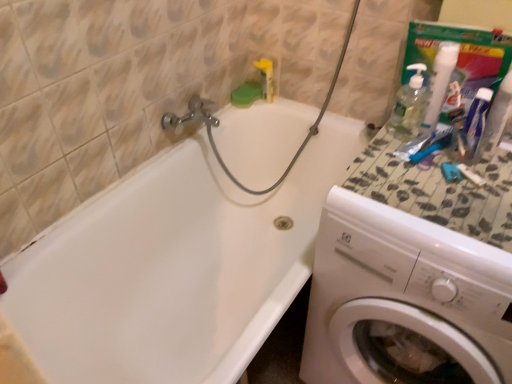
Describe the element at coordinates (404, 300) in the screenshot. This screenshot has width=512, height=384. I see `white plastic washing machine at right` at that location.

At what (x,y) coordinates should I click in order to perform the action: click on white plastic toothpaste at upper right. Please return your answer as a coordinate pair (x, y). Looking at the image, I should click on (x=498, y=113).

What is the approximate height of yellow plastic toothbrush at upper center?

yellow plastic toothbrush at upper center is 7.00 inches tall.

What do you see at coordinates (266, 78) in the screenshot?
I see `yellow plastic toothbrush at upper center` at bounding box center [266, 78].

What do you see at coordinates (438, 190) in the screenshot?
I see `speckled stone countertop at right` at bounding box center [438, 190].

This screenshot has width=512, height=384. I want to click on white pump bottle at upper right, which is counted as the 2th cleaning product, starting from the left, so click(x=439, y=83).

This screenshot has width=512, height=384. Describe the element at coordinates (410, 104) in the screenshot. I see `clear liquid soap at upper right, marked as the first cleaning product in a left-to-right arrangement` at that location.

Locate an element on the screen. This screenshot has height=384, width=512. white plastic washing machine at right is located at coordinates (404, 300).

Considering the sizes of white plastic toothpaste at upper right and white pump bottle at upper right, which is counted as the 2th cleaning product, starting from the left, in the image, is white plastic toothpaste at upper right taller or shorter than white pump bottle at upper right, which is counted as the 2th cleaning product, starting from the left,?

In the image, white plastic toothpaste at upper right appears to be shorter than white pump bottle at upper right, which is counted as the 2th cleaning product, starting from the left.

Considering the sizes of objects white plastic toothpaste at upper right and white pump bottle at upper right, which is counted as the 2th cleaning product, starting from the left, in the image provided, who is smaller, white plastic toothpaste at upper right or white pump bottle at upper right, which is counted as the 2th cleaning product, starting from the left,?

white plastic toothpaste at upper right.

Is white pump bottle at upper right, the 1th cleaning product viewed from the right, surrounded by white plastic toothpaste at upper right?

No, white pump bottle at upper right, the 1th cleaning product viewed from the right, is not inside white plastic toothpaste at upper right.

Are white plastic washing machine at right and white pump bottle at upper right, which is counted as the 2th cleaning product, starting from the left, located far from each other?

white plastic washing machine at right is near white pump bottle at upper right, which is counted as the 2th cleaning product, starting from the left, not far away.

Does white plastic washing machine at right contain white pump bottle at upper right, the 1th cleaning product viewed from the right?

No, white pump bottle at upper right, the 1th cleaning product viewed from the right, is not inside white plastic washing machine at right.

Considering the positions of point (302, 375) and point (457, 57), is point (302, 375) closer or farther from the camera than point (457, 57)?

Point (302, 375).

Is white pump bottle at upper right, which is counted as the 2th cleaning product, starting from the left, at the back of white plastic washing machine at right?

No.

Is white glossy bathtub at upper left next to clear liquid soap at upper right, marked as the first cleaning product in a left-to-right arrangement, and touching it?

No, white glossy bathtub at upper left is not in contact with clear liquid soap at upper right, marked as the first cleaning product in a left-to-right arrangement.

Is point (32, 265) in front of point (406, 97)?

Yes, it is in front of point (406, 97).

Is white glossy bathtub at upper left positioned with its back to clear liquid soap at upper right, positioned as the 2th cleaning product in right-to-left order?

No, white glossy bathtub at upper left's orientation is not away from clear liquid soap at upper right, positioned as the 2th cleaning product in right-to-left order.

Is white plastic toothpaste at upper right touching yellow plastic toothbrush at upper center?

white plastic toothpaste at upper right and yellow plastic toothbrush at upper center are clearly separated.

Does point (511, 108) appear closer or farther from the camera than point (267, 59)?

Point (511, 108) is closer to the camera than point (267, 59).

Does white plastic toothpaste at upper right have a lesser height compared to yellow plastic toothbrush at upper center?

Incorrect, the height of white plastic toothpaste at upper right does not fall short of that of yellow plastic toothbrush at upper center.

The width and height of the screenshot is (512, 384). What are the coordinates of `bottle above the yellow plastic toothbrush at upper center (from a real-world perspective)` in the screenshot? It's located at (498, 113).

Considering the relative positions of yellow plastic toothbrush at upper center and white plastic toothpaste at upper right in the image provided, is yellow plastic toothbrush at upper center behind white plastic toothpaste at upper right?

Yes, yellow plastic toothbrush at upper center is behind white plastic toothpaste at upper right.

Does yellow plastic toothbrush at upper center have a greater height compared to white plastic toothpaste at upper right?

No.

Considering the points (271, 63) and (486, 145), which point is behind, point (271, 63) or point (486, 145)?

The point (271, 63) is more distant.

Can you confirm if yellow plastic toothbrush at upper center is thinner than white plastic toothpaste at upper right?

No, yellow plastic toothbrush at upper center is not thinner than white plastic toothpaste at upper right.

From a real-world perspective, is speckled stone countertop at right under white plastic washing machine at right?

Incorrect, from a real-world perspective, speckled stone countertop at right is higher than white plastic washing machine at right.

Where is `counter top above the white plastic washing machine at right (from a real-world perspective)`? The image size is (512, 384). counter top above the white plastic washing machine at right (from a real-world perspective) is located at coordinates (438, 190).

Consider the image. Does speckled stone countertop at right turn towards white plastic washing machine at right?

Yes, speckled stone countertop at right is turned towards white plastic washing machine at right.

Is speckled stone countertop at right at the right side of white plastic washing machine at right?

Incorrect, speckled stone countertop at right is not on the right side of white plastic washing machine at right.

From a real-world perspective, which is physically below, white plastic washing machine at right or white plastic toothpaste at upper right?

white plastic washing machine at right, from a real-world perspective.

How far apart are white plastic washing machine at right and white plastic toothpaste at upper right?

white plastic washing machine at right and white plastic toothpaste at upper right are 20.45 inches apart from each other.

Is white plastic washing machine at right in contact with white plastic toothpaste at upper right?

No, white plastic washing machine at right is not in contact with white plastic toothpaste at upper right.

Image resolution: width=512 pixels, height=384 pixels. In order to click on the 2nd cleaning product behind when counting from the white plastic toothpaste at upper right in this screenshot , I will do `click(439, 83)`.

From a real-world perspective, which cleaning product is the 2nd one above the white plastic washing machine at right? Please provide its 2D coordinates.

[(439, 83)]

Based on their spatial positions, is clear liquid soap at upper right, positioned as the 2th cleaning product in right-to-left order, or white plastic toothpaste at upper right further from white pump bottle at upper right, which is counted as the 2th cleaning product, starting from the left?

Based on the image, white plastic toothpaste at upper right appears to be further to white pump bottle at upper right, which is counted as the 2th cleaning product, starting from the left.

Considering their positions, is white pump bottle at upper right, the 1th cleaning product viewed from the right, positioned further to yellow plastic toothbrush at upper center than speckled stone countertop at right?

speckled stone countertop at right is positioned further to the anchor yellow plastic toothbrush at upper center.

From the image, which object appears to be farther from white pump bottle at upper right, the 1th cleaning product viewed from the right, speckled stone countertop at right or clear liquid soap at upper right, marked as the first cleaning product in a left-to-right arrangement?

speckled stone countertop at right is positioned further to the anchor white pump bottle at upper right, the 1th cleaning product viewed from the right.

When comparing their distances from clear liquid soap at upper right, positioned as the 2th cleaning product in right-to-left order, does white glossy bathtub at upper left or white plastic washing machine at right seem closer?

white plastic washing machine at right lies closer to clear liquid soap at upper right, positioned as the 2th cleaning product in right-to-left order, than the other object.

Estimate the real-world distances between objects in this image. Which object is further from white plastic washing machine at right, white pump bottle at upper right, the 1th cleaning product viewed from the right, or white plastic toothpaste at upper right?

white plastic toothpaste at upper right lies further to white plastic washing machine at right than the other object.

Looking at the image, which one is located closer to white plastic washing machine at right, white glossy bathtub at upper left or clear liquid soap at upper right, positioned as the 2th cleaning product in right-to-left order?

The object closer to white plastic washing machine at right is clear liquid soap at upper right, positioned as the 2th cleaning product in right-to-left order.

Which object lies nearer to the anchor point speckled stone countertop at right, white plastic washing machine at right or white glossy bathtub at upper left?

The object closer to speckled stone countertop at right is white plastic washing machine at right.

When comparing their distances from speckled stone countertop at right, does white pump bottle at upper right, which is counted as the 2th cleaning product, starting from the left, or white plastic toothpaste at upper right seem further?

white pump bottle at upper right, which is counted as the 2th cleaning product, starting from the left.

Find the location of a particular element. bottle between speckled stone countertop at right and yellow plastic toothbrush at upper center in the front-back direction is located at coordinates (498, 113).

Locate an element on the screen. The width and height of the screenshot is (512, 384). bottle between white pump bottle at upper right, which is counted as the 2th cleaning product, starting from the left, and speckled stone countertop at right from top to bottom is located at coordinates 498,113.

Where is `bottle that lies between white pump bottle at upper right, the 1th cleaning product viewed from the right, and white plastic washing machine at right from top to bottom`? This screenshot has height=384, width=512. bottle that lies between white pump bottle at upper right, the 1th cleaning product viewed from the right, and white plastic washing machine at right from top to bottom is located at coordinates (498, 113).

Identify the location of bottle located between white plastic washing machine at right and yellow plastic toothbrush at upper center in the depth direction. The image size is (512, 384). (498, 113).